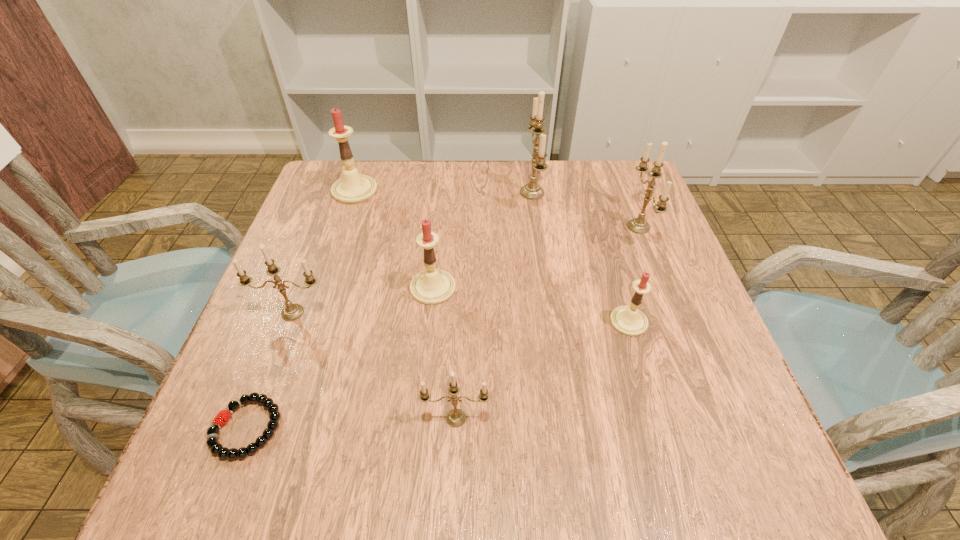
Find the location of `the second metallic candle from right to left`. the second metallic candle from right to left is located at coordinates (532, 191).

The image size is (960, 540). What are the coordinates of `the tallest object` in the screenshot? It's located at (532, 191).

Identify the location of the farthest red candle. The width and height of the screenshot is (960, 540). (353, 188).

Identify the location of the biggest red candle. This screenshot has height=540, width=960. (353, 188).

In order to click on the rightmost candle in this screenshot , I will do `click(639, 225)`.

Where is `the second biggest metallic candle`? The height and width of the screenshot is (540, 960). the second biggest metallic candle is located at coordinates (639, 225).

Identify the location of the second red candle from right to left. This screenshot has height=540, width=960. (433, 286).

Identify the location of the second farthest red candle. (433, 286).

Identify the location of the third farthest metallic candle. The width and height of the screenshot is (960, 540). (291, 312).

Locate an element on the screen. This screenshot has width=960, height=540. the second smallest metallic candle is located at coordinates point(291,312).